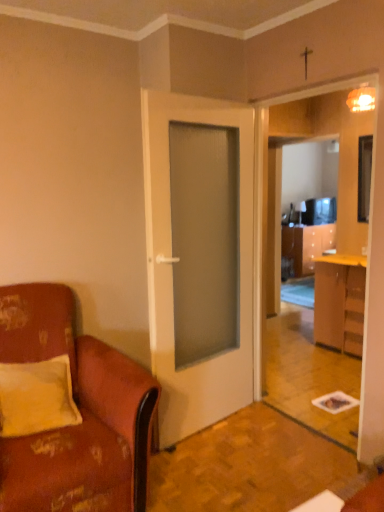
Question: From a real-world perspective, relative to wooden cabinet at right, is white matte door at center vertically above or below?

Choices:
 (A) above
 (B) below

Answer: (A)

Question: Considering the positions of white matte door at center and wooden cabinet at right in the image, is white matte door at center wider or thinner than wooden cabinet at right?

Choices:
 (A) thin
 (B) wide

Answer: (A)

Question: Estimate the real-world distances between objects in this image. Which object is closer to the wooden cabinet at right?

Choices:
 (A) black glossy television at right
 (B) leather at left
 (C) yellow fabric pillow at left
 (D) white matte door at center

Answer: (A)

Question: Estimate the real-world distances between objects in this image. Which object is farther from the leather at left?

Choices:
 (A) black glossy television at right
 (B) yellow fabric pillow at left
 (C) white matte door at center
 (D) wooden cabinet at right

Answer: (A)